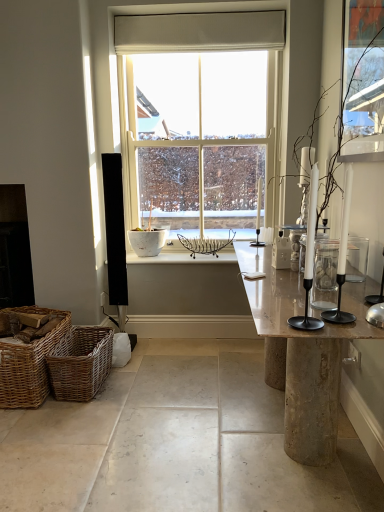
You are a GUI agent. You are given a task and a screenshot of the screen. Output one action in this format:
    pyautogui.click(x=<x>, y=<y>)
    Task: Click on the vacant area situated below white fabric curtain at upper center (from a real-world perspective)
    
    Given the screenshot: What is the action you would take?
    pyautogui.click(x=192, y=49)